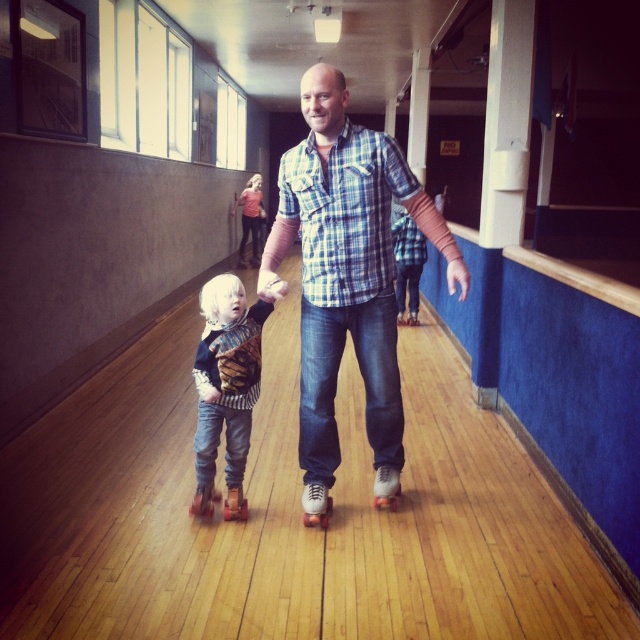
You are a photographer standing at the entrance of the roller skating rink. You want to take a photo that includes both the blue plaid shirt at center and the white matte roller skate at center. Which object should you focus on first if you want to ensure both are in the frame?

The blue plaid shirt at center is bigger than the white matte roller skate at center, so you should focus on the blue plaid shirt at center first to ensure both are in the frame.

You are a safety inspector checking the skating rink. You notice the blue plaid shirt at center and the white matte roller skate at center. According to safety regulations, there must be at least 60 centimeters between any person and their nearest roller skate to prevent collisions. Does this setup comply with the regulation?

The distance between the blue plaid shirt at center and the white matte roller skate at center is 64.41 centimeters, which exceeds the required 60 centimeters. Therefore, this setup complies with the safety regulation.